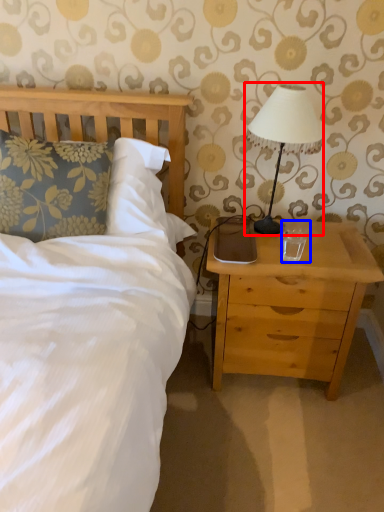
Question: Which of the following is the farthest to the observer, table lamp (highlighted by a red box) or coffee cup (highlighted by a blue box)?

Choices:
 (A) table lamp
 (B) coffee cup

Answer: (B)